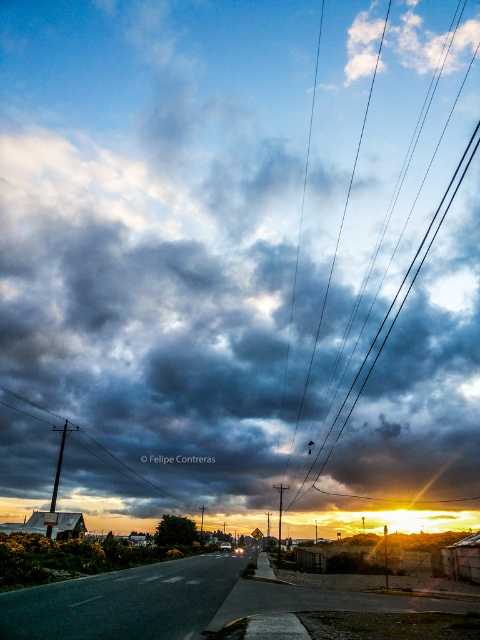
Is point (466, 156) positioned after point (288, 484)?

Yes, point (466, 156) is behind point (288, 484).

Is point (384, 316) in front of point (279, 547)?

No, (384, 316) is further to viewer.

Image resolution: width=480 pixels, height=640 pixels. Identify the location of black wire at upper center. (384, 326).

What do you see at coordinates (384, 326) in the screenshot? I see `black wire at upper center` at bounding box center [384, 326].

Locate an element on the screen. black wire at upper center is located at coordinates (384, 326).

Can you confirm if dark gray wooden pole at left is smaller than smooth metallic pole at center?

No, dark gray wooden pole at left is not smaller than smooth metallic pole at center.

Does point (48, 410) come behind point (279, 552)?

Yes, point (48, 410) is behind point (279, 552).

What do you see at coordinates (132, 468) in the screenshot? The image size is (480, 640). I see `dark gray wooden pole at left` at bounding box center [132, 468].

I want to click on dark gray wooden pole at left, so click(132, 468).